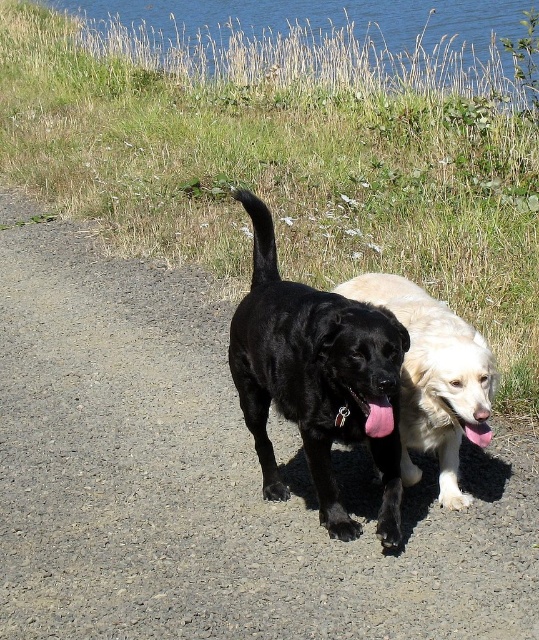
Can you confirm if shiny golden fur at center is positioned below pink fabric tongue at center?

Actually, shiny golden fur at center is above pink fabric tongue at center.

Can you confirm if shiny golden fur at center is thinner than pink fabric tongue at center?

No.

Who is more distant from viewer, (444,358) or (378,429)?

The point (444,358) is more distant.

Locate an element on the screen. This screenshot has height=640, width=539. shiny golden fur at center is located at coordinates (432, 376).

Which is more to the left, blue water at upper center or shiny golden fur at center?

Positioned to the left is shiny golden fur at center.

Is blue water at upper center further to camera compared to shiny golden fur at center?

Yes.

Is point (423, 26) farther from camera compared to point (433, 356)?

Yes.

Find the location of `blue water at upper center`. blue water at upper center is located at coordinates (321, 42).

Does black matte dog at center lie behind pink fabric tongue at center?

No, it is in front of pink fabric tongue at center.

What do you see at coordinates (314, 376) in the screenshot? I see `black matte dog at center` at bounding box center [314, 376].

Locate an element on the screen. The image size is (539, 640). black matte dog at center is located at coordinates (314, 376).